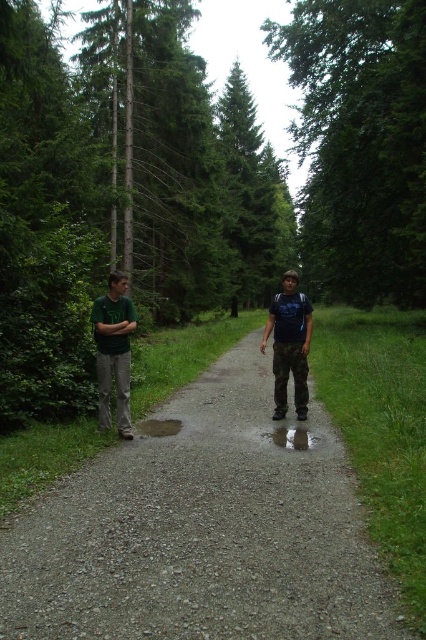
Is point (356, 276) less distant than point (111, 340)?

No.

Is green leafy tree at center smaller than green matte shirt at left?

No.

Describe the element at coordinates (359, 144) in the screenshot. This screenshot has width=426, height=640. I see `green leafy tree at center` at that location.

The width and height of the screenshot is (426, 640). In order to click on green leafy tree at center in this screenshot , I will do `click(359, 144)`.

Does green fabric shirt at center appear over green matte shirt at left?

Correct, green fabric shirt at center is located above green matte shirt at left.

Is green fabric shirt at center taller than green matte shirt at left?

Correct, green fabric shirt at center is much taller as green matte shirt at left.

Where is `green fabric shirt at center`? The width and height of the screenshot is (426, 640). green fabric shirt at center is located at coordinates (114, 349).

Does green leafy tree at center have a larger size compared to green fabric shirt at center?

Indeed, green leafy tree at center has a larger size compared to green fabric shirt at center.

Does green leafy tree at center have a lesser width compared to green fabric shirt at center?

Incorrect, green leafy tree at center's width is not less than green fabric shirt at center's.

Does point (405, 72) come in front of point (124, 332)?

No, it is not.

Find the location of `green leafy tree at center`. green leafy tree at center is located at coordinates (359, 144).